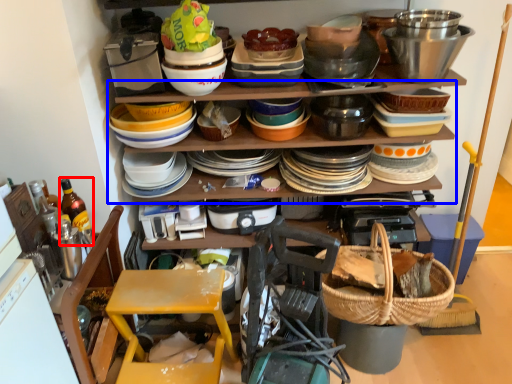
Question: Which point is further to the camera, bottle (highlighted by a red box) or shelf (highlighted by a blue box)?

Choices:
 (A) bottle
 (B) shelf

Answer: (B)